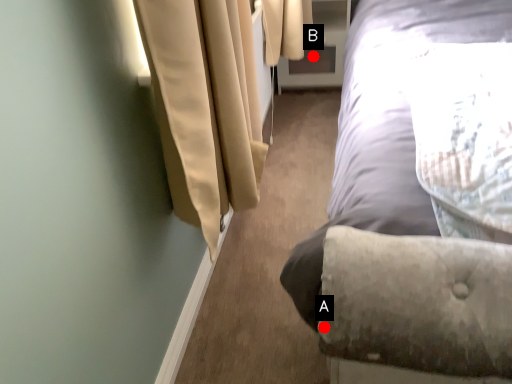
Question: Two points are circled on the image, labeled by A and B beside each circle. Among these points, which one is nearest to the camera?

Choices:
 (A) A is closer
 (B) B is closer

Answer: (A)